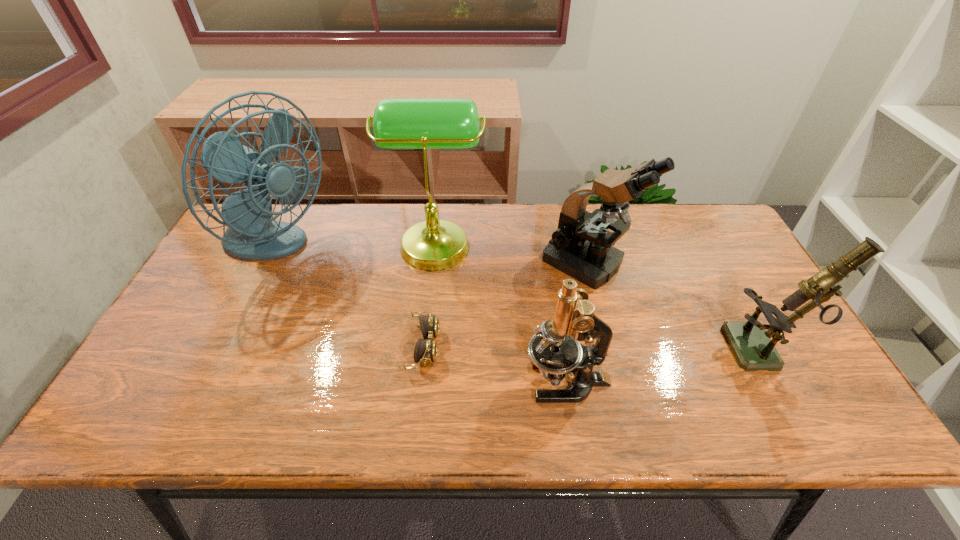
The height and width of the screenshot is (540, 960). In order to click on free space located 0.170m at the eyepiece of the rightmost object in this screenshot , I will do `click(663, 352)`.

Locate an element on the screen. blank space located 0.190m through the lenses of the goggles is located at coordinates (516, 347).

Find the location of a particular element. fan present at the far edge is located at coordinates (251, 234).

Find the location of a particular element. This screenshot has width=960, height=540. lamp present at the far edge is located at coordinates (398, 123).

The width and height of the screenshot is (960, 540). What are the coordinates of `microscope situated at the far edge` in the screenshot? It's located at (581, 247).

Identify the location of object at the near edge. (554, 349).

Where is `object that is at the left edge`? object that is at the left edge is located at coordinates (251, 234).

Where is `object present at the right edge`? object present at the right edge is located at coordinates (750, 342).

Image resolution: width=960 pixels, height=540 pixels. Identify the location of object positioned at the far left corner. (251, 234).

Image resolution: width=960 pixels, height=540 pixels. Identify the location of blank space at the near edge of the desktop. (523, 408).